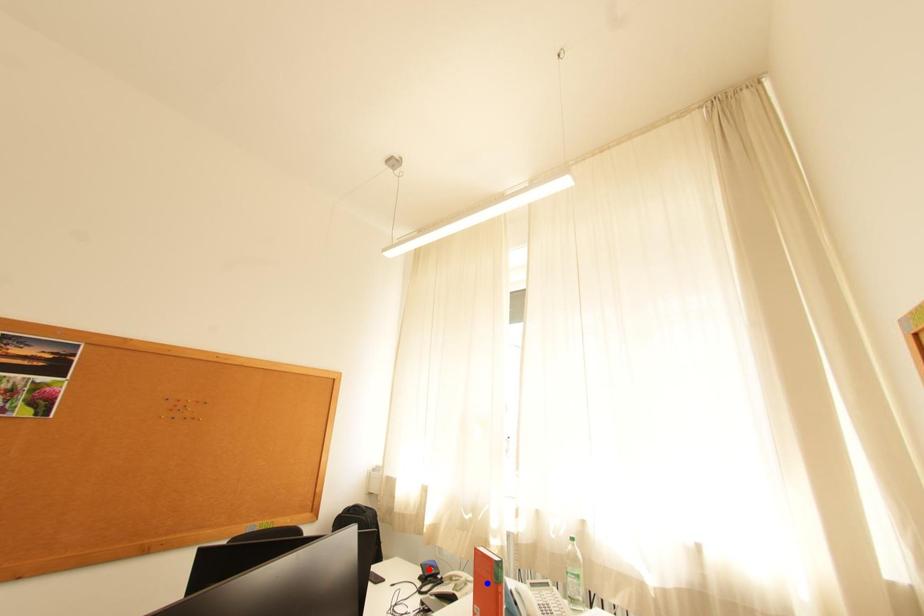
Question: Which of the two points in the image is closer to the camera?

Choices:
 (A) Blue point is closer.
 (B) Red point is closer.

Answer: (A)